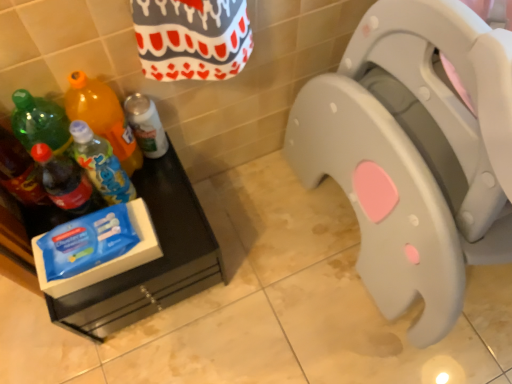
Question: From the image's perspective, relative to gray plastic toilet seat at center, is translucent plastic soda bottle at left, the fourth bottle when ordered from right to left, above or below?

Choices:
 (A) above
 (B) below

Answer: (B)

Question: From a real-world perspective, relative to gray plastic toilet seat at center, is translucent plastic soda bottle at left, the fourth bottle when ordered from right to left, vertically above or below?

Choices:
 (A) below
 (B) above

Answer: (A)

Question: Which object is the farthest from the white matte spray can at lower left, which ranks as the 5th bottle in left-to-right order?

Choices:
 (A) blue plastic bottle at left, arranged as the fourth bottle when viewed from the left
 (B) translucent plastic soda bottle at left, which appears as the 5th bottle when viewed from the right
 (C) translucent plastic soda bottle at left, which is the second bottle from left to right
 (D) gray plastic toilet seat at center
 (E) translucent plastic bottle at left, which appears as the 3th bottle when viewed from the right

Answer: (D)

Question: Which object is the farthest from the translucent plastic soda bottle at left, which appears as the 5th bottle when viewed from the right?

Choices:
 (A) white matte spray can at lower left, the first bottle positioned from the right
 (B) translucent plastic soda bottle at left, the fourth bottle when ordered from right to left
 (C) blue plastic bottle at left, arranged as the fourth bottle when viewed from the left
 (D) translucent plastic bottle at left, which is the third bottle from left to right
 (E) gray plastic toilet seat at center

Answer: (E)